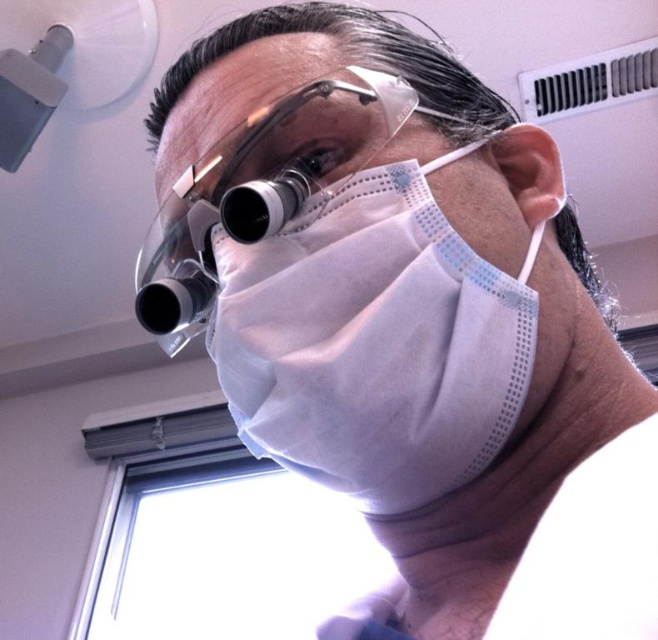
Question: Does white matte mask at center come behind transparent plastic goggles at center?

Choices:
 (A) no
 (B) yes

Answer: (A)

Question: Is white matte mask at center bigger than transparent plastic goggles at center?

Choices:
 (A) no
 (B) yes

Answer: (A)

Question: Is white matte mask at center smaller than transparent plastic goggles at center?

Choices:
 (A) no
 (B) yes

Answer: (B)

Question: Which point is farther to the camera?

Choices:
 (A) (342, 444)
 (B) (361, 129)

Answer: (B)

Question: Which object is farther from the camera taking this photo?

Choices:
 (A) transparent plastic goggles at center
 (B) white matte mask at center

Answer: (A)